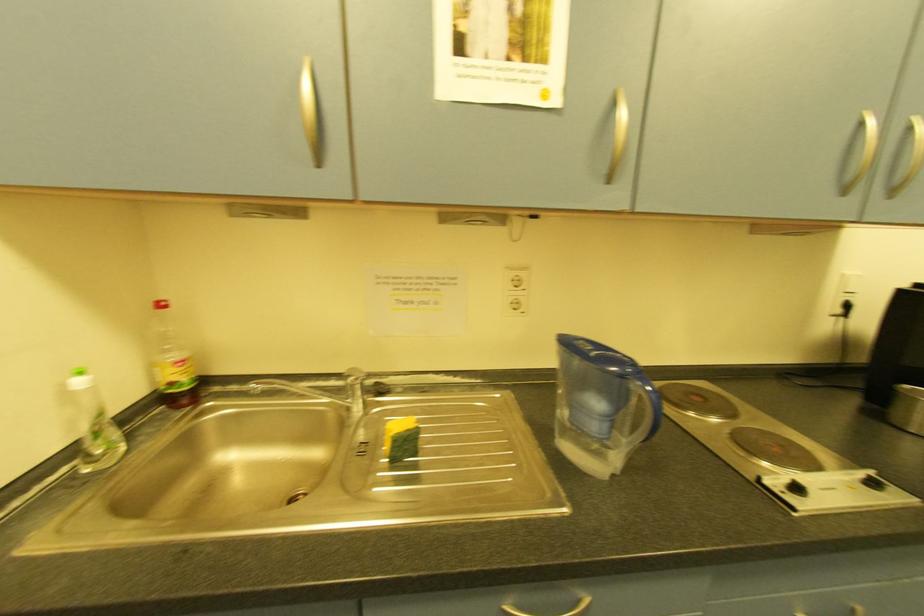
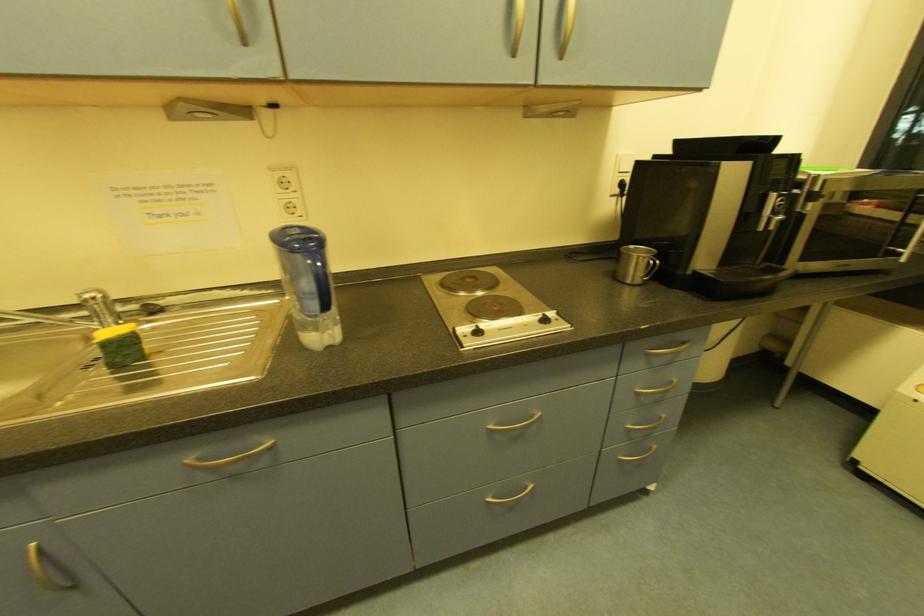
Question: In a continuous first-person perspective shot, in which direction is the camera moving?

Choices:
 (A) Left
 (B) Right
 (C) Forward
 (D) Backward

Answer: (B)